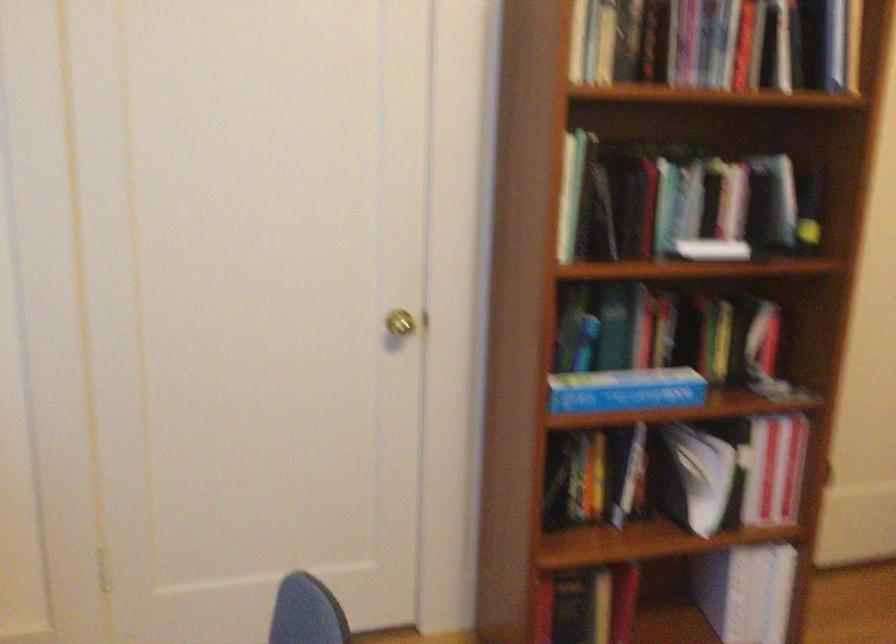
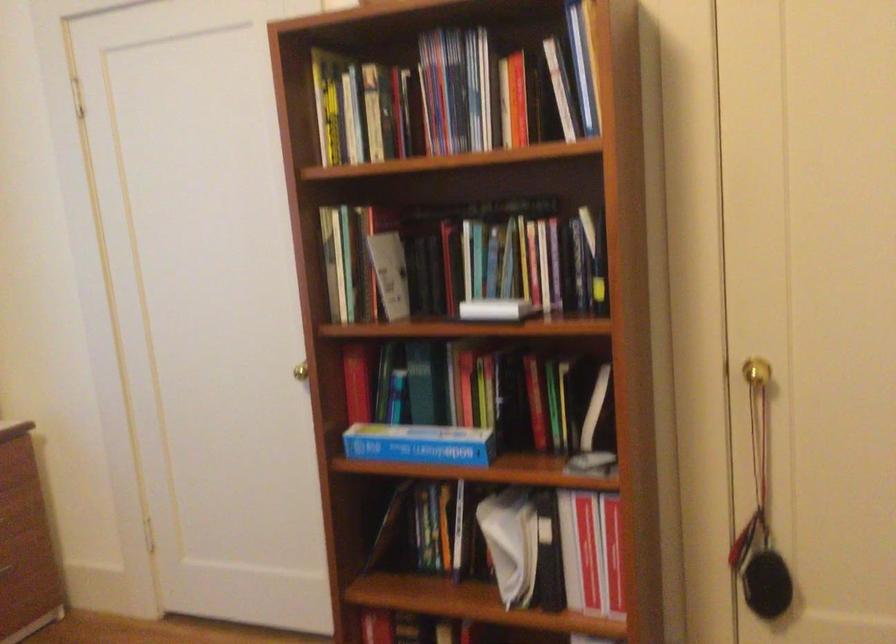
Where in the second image is the point corresponding to (746,477) from the first image?

(570, 552)